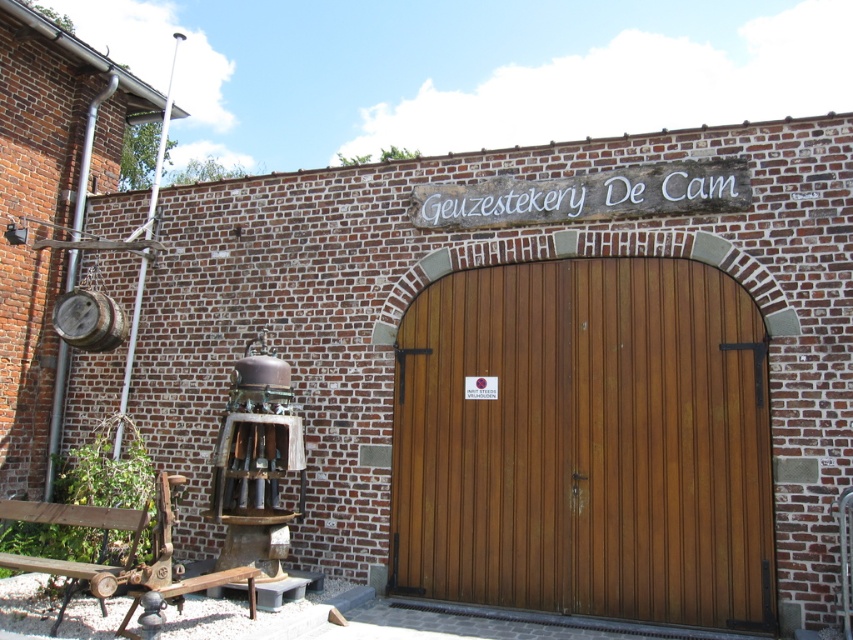
Is point (749, 468) more distant than point (67, 520)?

Yes.

Does wooden at center appear over wooden bench at lower left?

Correct, wooden at center is located above wooden bench at lower left.

Which is in front, point (711, 625) or point (7, 561)?

Point (7, 561) is in front.

Locate an element on the screen. wooden at center is located at coordinates pos(585,444).